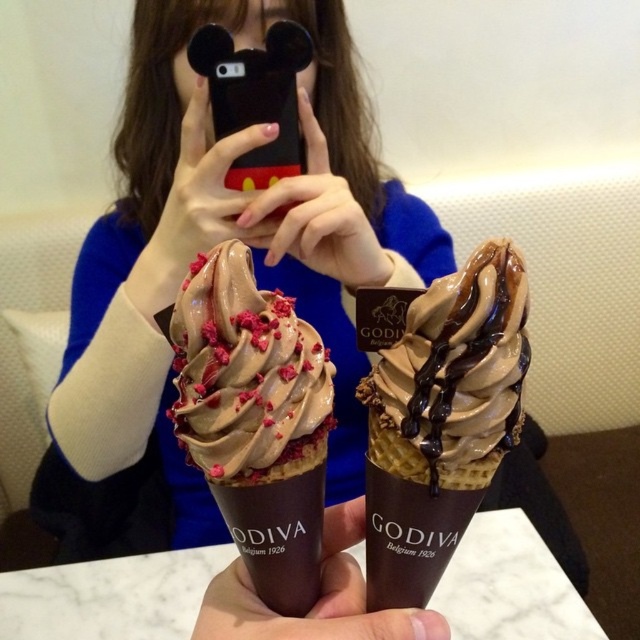
From the picture: You are a photographer trying to capture both the chocolatesmoothice cream cone at center and the chocolate waffle cone at center in a single closeup shot. Given that your camera can only focus on one subject at a time, which cone should you focus on to ensure it appears clearer in the photo?

The chocolatesmoothice cream cone at center is larger in size than the chocolate waffle cone at center, so focusing on it would ensure it appears clearer in the photo.

You are taking a photo of two ice cream cones on a table. You notice two points marked at coordinates point [305,404] and point [486,376]. Which point is closer to the camera?

Point [305,404] is further to the camera than point [486,376], so the closer point to the camera is point [486,376].